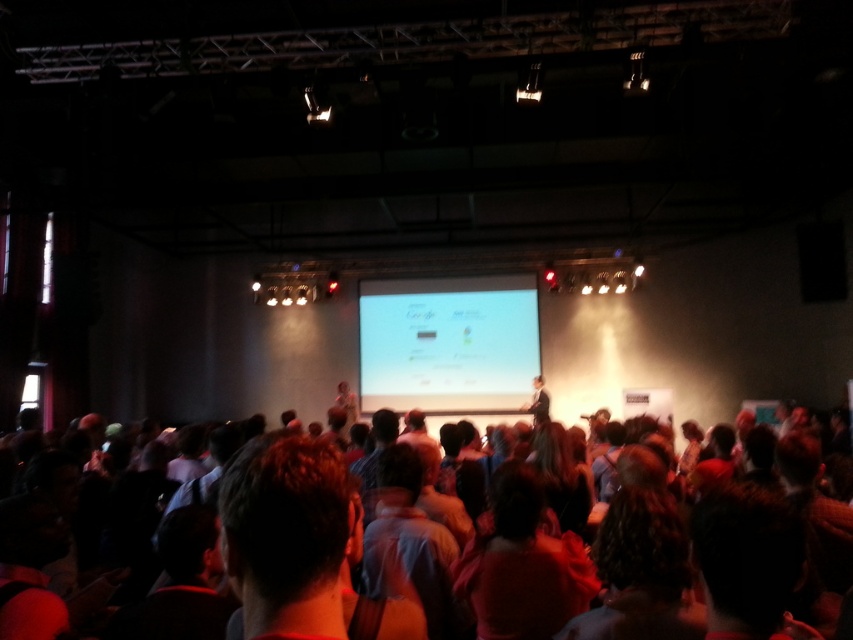
Which is more to the right, white glossy projection screen at center or dark brown hair at center?

Positioned to the right is dark brown hair at center.

Is point (485, 337) positioned after point (747, 486)?

Yes, it is.

This screenshot has height=640, width=853. I want to click on white glossy projection screen at center, so click(x=448, y=342).

From the picture: Is dark red fabric at center closer to the viewer compared to dark brown hair at center?

No, dark red fabric at center is further to the viewer.

Who is taller, dark red fabric at center or dark brown hair at center?

dark red fabric at center

Does point (567, 611) lie behind point (802, 492)?

No, (567, 611) is closer to viewer.

Where is `dark red fabric at center`? The width and height of the screenshot is (853, 640). dark red fabric at center is located at coordinates (x=521, y=564).

Which is in front, point (370, 324) or point (546, 596)?

Point (546, 596) is more forward.

Does white glossy projection screen at center appear under dark red fabric at center?

Actually, white glossy projection screen at center is above dark red fabric at center.

The height and width of the screenshot is (640, 853). I want to click on white glossy projection screen at center, so click(x=448, y=342).